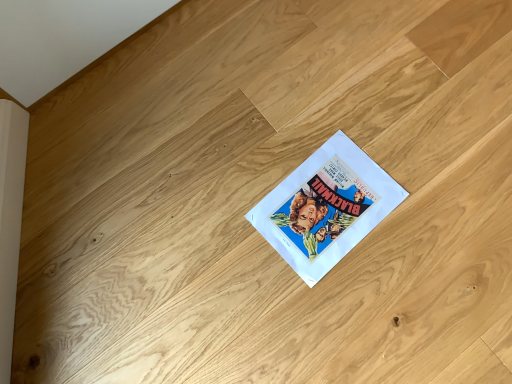
Where is `white paper at center`? white paper at center is located at coordinates (326, 207).

Describe the element at coordinates (326, 207) in the screenshot. I see `white paper at center` at that location.

Identify the location of white paper at center. The width and height of the screenshot is (512, 384). (326, 207).